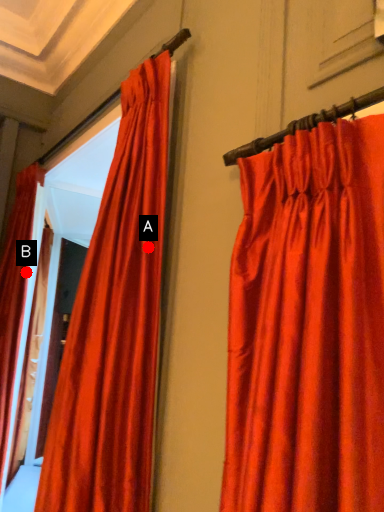
Question: Two points are circled on the image, labeled by A and B beside each circle. Which of the following is the farthest from the observer?

Choices:
 (A) A is further
 (B) B is further

Answer: (B)